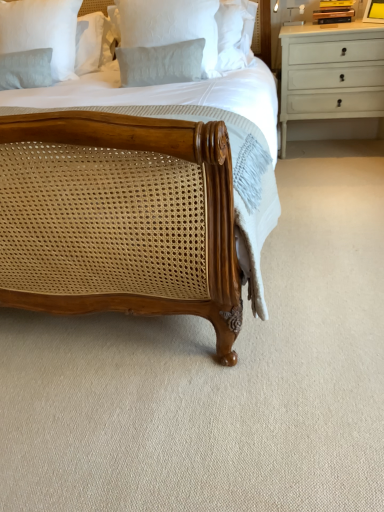
Question: Is yellow matte picture frame at upper right to the left or to the right of light gray textured pillow at upper left, positioned as the first pillow in left-to-right order, in the image?

Choices:
 (A) right
 (B) left

Answer: (A)

Question: Considering the positions of yellow matte picture frame at upper right and light gray textured pillow at upper left, the 2th pillow positioned from the front, in the image, is yellow matte picture frame at upper right wider or thinner than light gray textured pillow at upper left, the 2th pillow positioned from the front,?

Choices:
 (A) thin
 (B) wide

Answer: (A)

Question: Which object is positioned farthest from the white textured pillow at upper center, the second pillow positioned from the left?

Choices:
 (A) white painted wood chest of drawers at upper right
 (B) light gray textured pillow at upper left, the 2th pillow positioned from the front
 (C) yellow matte picture frame at upper right

Answer: (C)

Question: Based on their relative distances, which object is farther from the white painted wood chest of drawers at upper right?

Choices:
 (A) light gray textured pillow at upper left, positioned as the first pillow in left-to-right order
 (B) white textured pillow at upper center, the second pillow positioned from the left
 (C) yellow matte picture frame at upper right

Answer: (A)